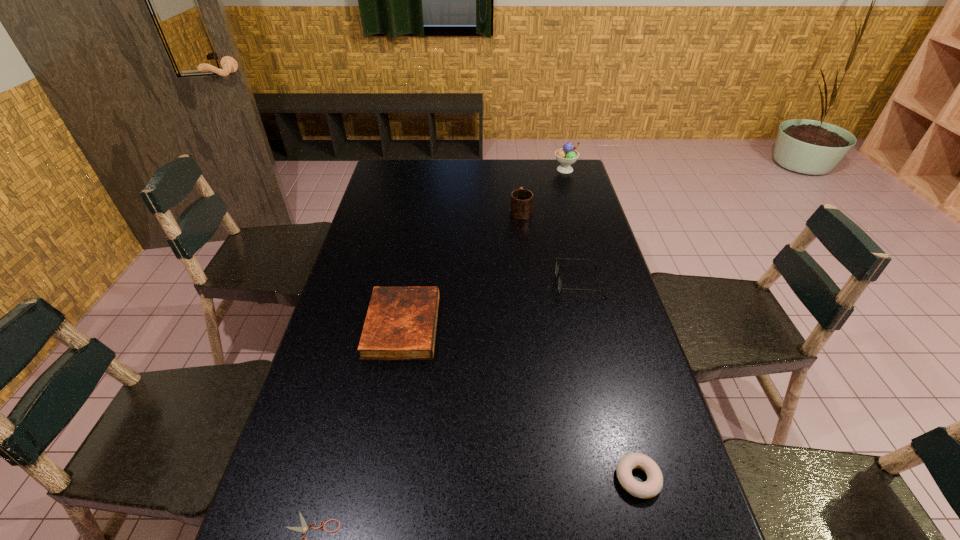
The width and height of the screenshot is (960, 540). I want to click on spectacles that is at the right edge, so click(x=560, y=289).

This screenshot has width=960, height=540. What are the coordinates of `doughnut situated at the right edge` in the screenshot? It's located at (652, 486).

Locate an element on the screen. The height and width of the screenshot is (540, 960). object positioned at the far right corner is located at coordinates (566, 156).

The image size is (960, 540). Find the location of `vacant space at the far edge of the desktop`. vacant space at the far edge of the desktop is located at coordinates (496, 167).

In the image, there is a desktop. What are the coordinates of `vacant region at the left edge` in the screenshot? It's located at pyautogui.click(x=405, y=193).

Identify the location of free space at the right edge. pos(573,259).

You are a GUI agent. You are given a task and a screenshot of the screen. Output one action in this format:
    pyautogui.click(x=<x>, y=<y>)
    Task: Click on the vacant space that is in between the fourth shortest object and the Bible
    The image size is (960, 540).
    Given the screenshot: What is the action you would take?
    pyautogui.click(x=491, y=305)

Find the location of a particular element. vacant point located between the doughnut and the fifth nearest object is located at coordinates (579, 344).

This screenshot has width=960, height=540. I want to click on vacant area that lies between the second farthest object and the doughnut, so click(579, 344).

Locate an element on the screen. free space between the icecream and the doughnut is located at coordinates (601, 324).